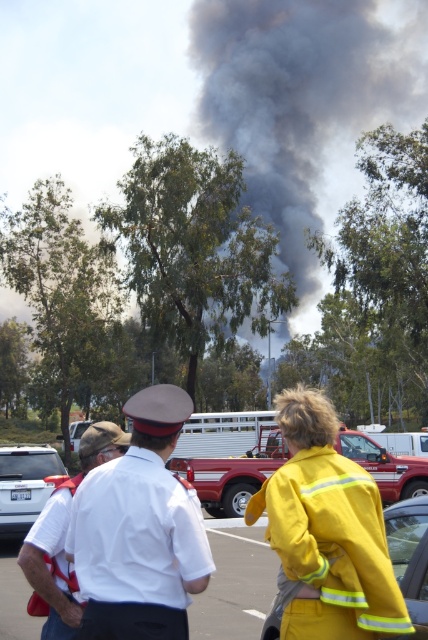
Question: Is metallic red fire truck at center positioned before white plastic car at center?

Choices:
 (A) yes
 (B) no

Answer: (A)

Question: Which point is farther to the camera?

Choices:
 (A) (85, 422)
 (B) (53, 531)
 (C) (39, 490)

Answer: (A)

Question: Which object is positioned farthest from the white matte suv at lower left?

Choices:
 (A) metallic red fire truck at center
 (B) white plastic car at center
 (C) yellow reflective jacket at lower right

Answer: (B)

Question: Is metallic red fire truck at center to the left of yellow reflective jacket at lower right from the viewer's perspective?

Choices:
 (A) yes
 (B) no

Answer: (B)

Question: Estimate the real-world distances between objects in this image. Which object is farther from the white matte suv at lower left?

Choices:
 (A) yellow reflective uniform at center
 (B) metallic red fire truck at center
 (C) white plastic car at center

Answer: (C)

Question: Is white uniform at center to the left of white plastic car at center from the viewer's perspective?

Choices:
 (A) yes
 (B) no

Answer: (B)